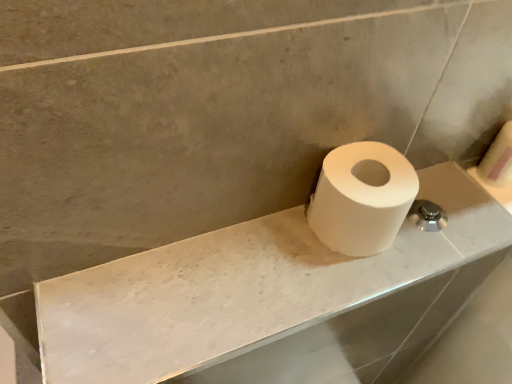
This screenshot has height=384, width=512. What are the coordinates of `vacant space to the right of white matte toilet paper at right, which is the 1th toilet paper from front to back` in the screenshot? It's located at [446, 224].